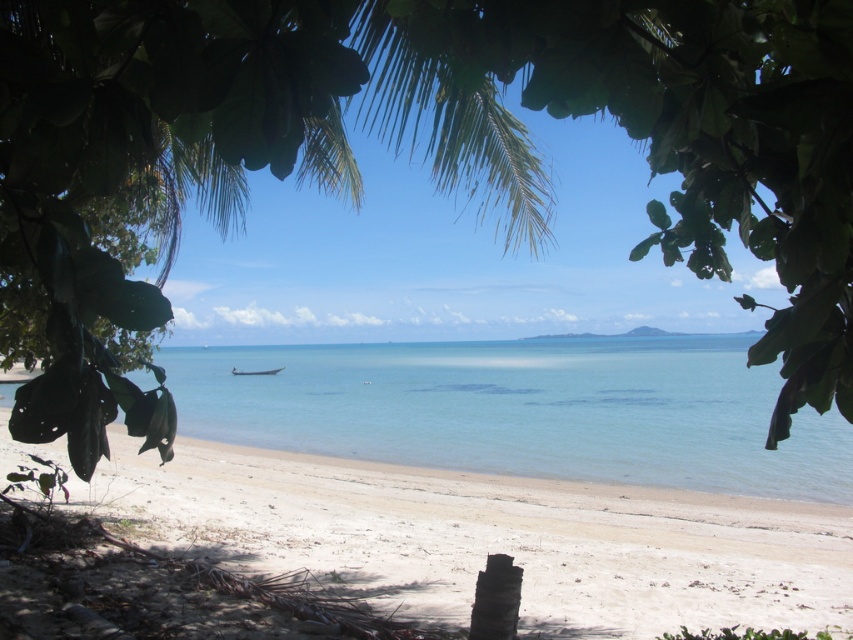
Between clear blue water at center and wooden boat at center, which one appears on the left side from the viewer's perspective?

Positioned to the left is wooden boat at center.

Locate an element on the screen. Image resolution: width=853 pixels, height=640 pixels. clear blue water at center is located at coordinates (523, 410).

I want to click on clear blue water at center, so click(523, 410).

Looking at this image, who is lower down, white sandy beach at lower center or wooden boat at center?

Positioned lower is white sandy beach at lower center.

Image resolution: width=853 pixels, height=640 pixels. What do you see at coordinates (491, 538) in the screenshot? I see `white sandy beach at lower center` at bounding box center [491, 538].

Who is more distant from viewer, (x=491, y=548) or (x=236, y=371)?

Point (x=236, y=371)

Locate an element on the screen. Image resolution: width=853 pixels, height=640 pixels. white sandy beach at lower center is located at coordinates coord(491,538).

Between point (337, 508) and point (567, 448), which one is positioned behind?

Positioned behind is point (567, 448).

Is point (258, 481) positioned before point (508, 394)?

Yes, it is.

Where is `white sandy beach at lower center`? The width and height of the screenshot is (853, 640). white sandy beach at lower center is located at coordinates (491, 538).